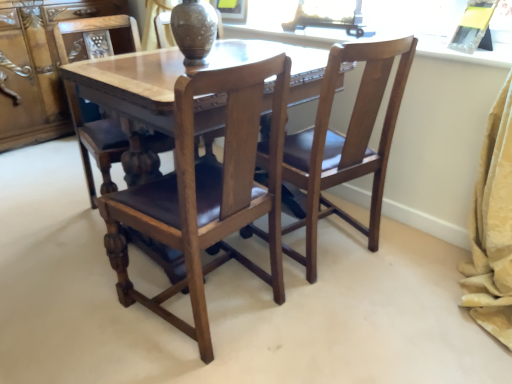
Find the location of a particular element. Image resolution: width=512 pixels, height=384 pixels. vacant region in front of wooden chair at center, which appears as the third chair when viewed from the left is located at coordinates (359, 309).